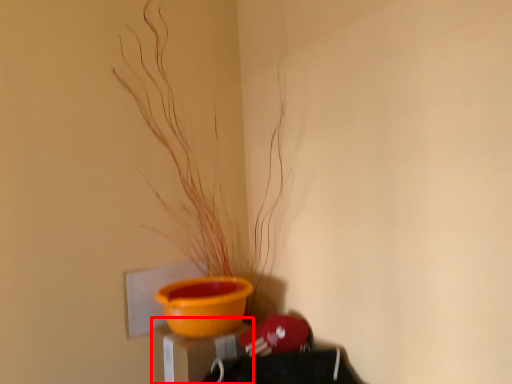
Question: From the image's perspective, where is table (annotated by the red box) located relative to houseplant?

Choices:
 (A) below
 (B) above

Answer: (A)